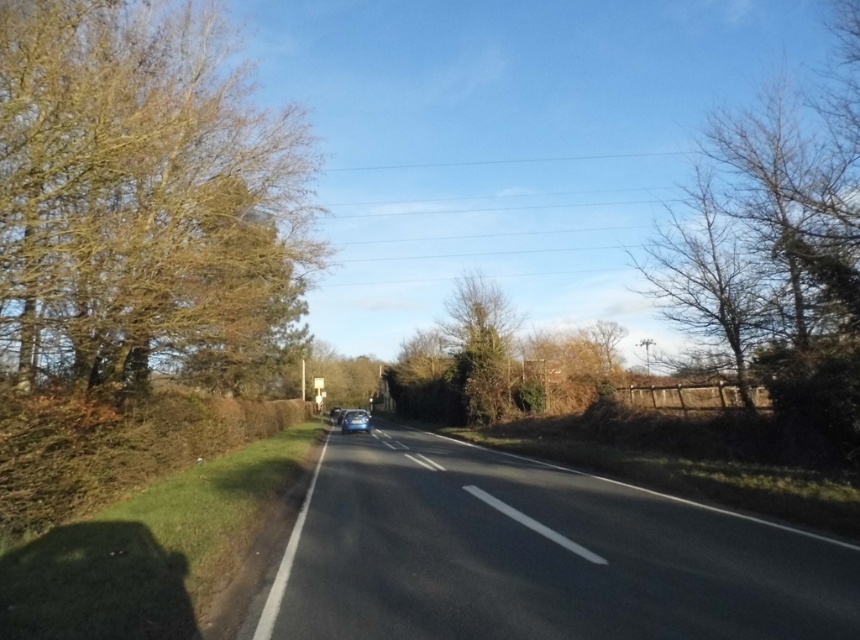
You are a driver approaching the road from the distance. You notice two trees ahead on the left and center of the road. The brown leafy tree at left and the green leafy tree at center. Which tree would appear taller to you as you drive closer?

The brown leafy tree at left is larger in size than the green leafy tree at center, so it would appear taller as you approach the road.

You are driving a car and see the brown leafy tree at left and the green leafy tree at center ahead on the road. Which tree is closer to the left side of the road?

The brown leafy tree at left is closer to the left side of the road because it is positioned to the left of the green leafy tree at center.

You are a pedestrian standing at the edge of the road. You see a green leafy tree at center and a glossy blue car at center. Which object is closer to you?

The glossy blue car at center is closer to you because the green leafy tree at center is above it, indicating that the car is in front of the tree from your perspective.